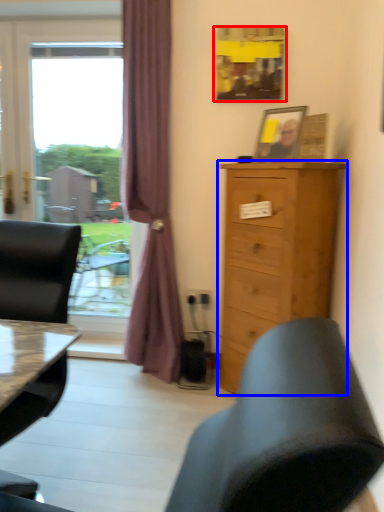
Question: Which object is further to the camera taking this photo, picture frame (highlighted by a red box) or chest of drawers (highlighted by a blue box)?

Choices:
 (A) picture frame
 (B) chest of drawers

Answer: (A)